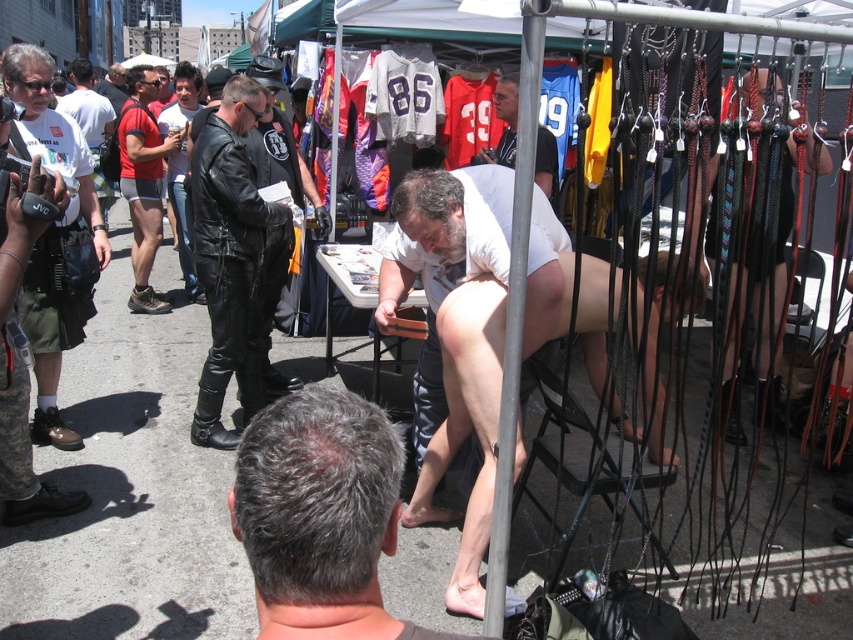
Question: Is gray hair at center positioned behind black leather pants at center?

Choices:
 (A) yes
 (B) no

Answer: (B)

Question: Does white matte shorts at center appear on the right side of white jersey at upper center?

Choices:
 (A) no
 (B) yes

Answer: (A)

Question: Which point is closer to the camera?

Choices:
 (A) pos(177,172)
 (B) pos(207,429)

Answer: (B)

Question: Is gray hair at center positioned at the back of white matte shorts at center?

Choices:
 (A) yes
 (B) no

Answer: (B)

Question: Which object is closer to the camera taking this photo?

Choices:
 (A) black leather pants at center
 (B) matte black leather jacket at upper left
 (C) white matte shorts at center

Answer: (C)

Question: Among these points, which one is farthest from the camera?

Choices:
 (A) (403, 285)
 (B) (502, 90)

Answer: (B)